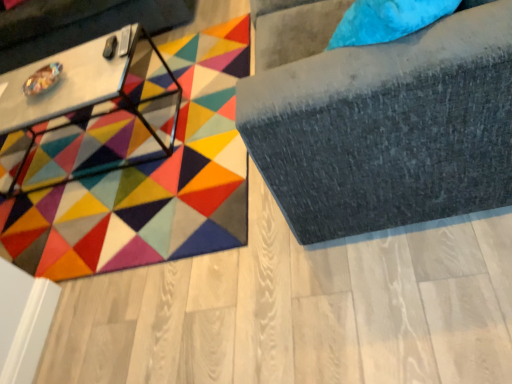
Question: From a real-world perspective, is metallic silver swivel chair at left on multicolored felt mat at center?

Choices:
 (A) yes
 (B) no

Answer: (A)

Question: Does metallic silver swivel chair at left appear on the right side of multicolored felt mat at center?

Choices:
 (A) yes
 (B) no

Answer: (B)

Question: Can you confirm if metallic silver swivel chair at left is wider than multicolored felt mat at center?

Choices:
 (A) no
 (B) yes

Answer: (A)

Question: Is multicolored felt mat at center a part of metallic silver swivel chair at left?

Choices:
 (A) yes
 (B) no

Answer: (B)

Question: Is metallic silver swivel chair at left thinner than multicolored felt mat at center?

Choices:
 (A) no
 (B) yes

Answer: (B)

Question: Considering the relative sizes of metallic silver swivel chair at left and multicolored felt mat at center in the image provided, is metallic silver swivel chair at left bigger than multicolored felt mat at center?

Choices:
 (A) no
 (B) yes

Answer: (B)

Question: Is white glossy table at upper left outside multicolored felt mat at center?

Choices:
 (A) no
 (B) yes

Answer: (B)

Question: Is white glossy table at upper left far from multicolored felt mat at center?

Choices:
 (A) yes
 (B) no

Answer: (B)

Question: From a real-world perspective, is white glossy table at upper left positioned under multicolored felt mat at center based on gravity?

Choices:
 (A) no
 (B) yes

Answer: (A)

Question: Does white glossy table at upper left touch multicolored felt mat at center?

Choices:
 (A) yes
 (B) no

Answer: (B)

Question: From a real-world perspective, is white glossy table at upper left physically above multicolored felt mat at center?

Choices:
 (A) no
 (B) yes

Answer: (B)

Question: Is white glossy table at upper left oriented towards multicolored felt mat at center?

Choices:
 (A) yes
 (B) no

Answer: (B)

Question: Does white glossy table at upper left come in front of metallic silver swivel chair at left?

Choices:
 (A) no
 (B) yes

Answer: (B)